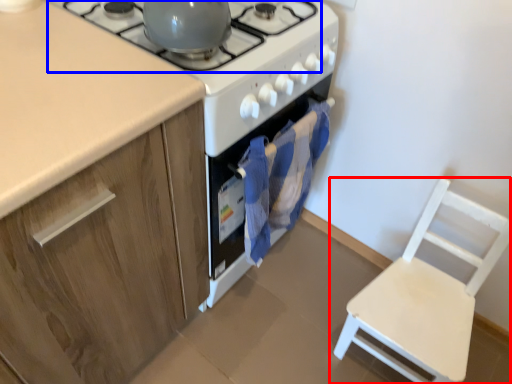
Question: Which of the following is the closest to the observer, chair (highlighted by a red box) or gas stove (highlighted by a blue box)?

Choices:
 (A) chair
 (B) gas stove

Answer: (B)